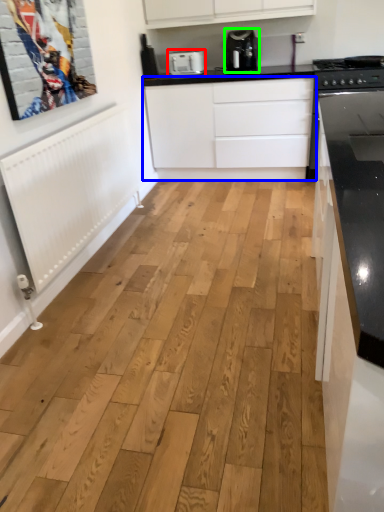
Question: Considering the real-world distances, which object is farthest from kitchen appliance (highlighted by a red box)? cabinetry (highlighted by a blue box) or home appliance (highlighted by a green box)?

Choices:
 (A) cabinetry
 (B) home appliance

Answer: (A)